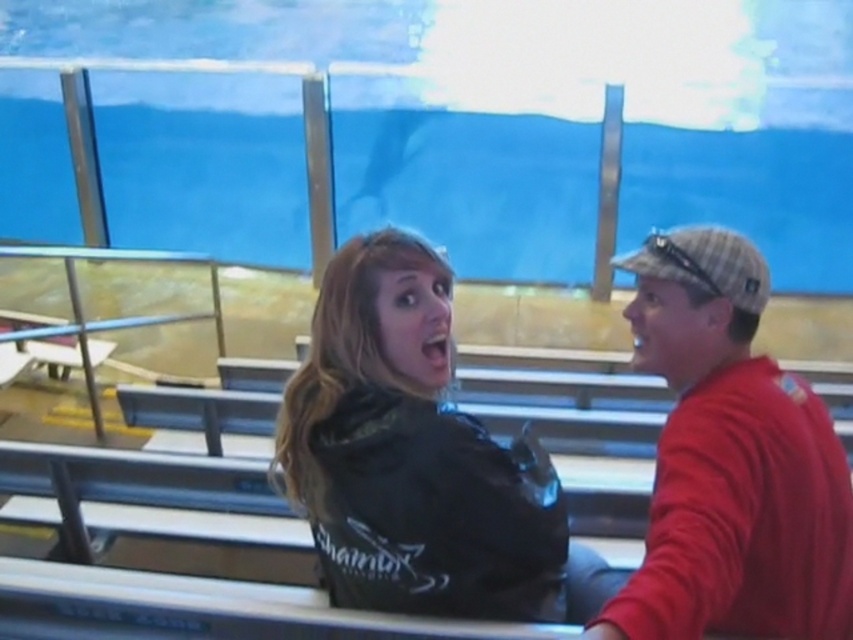
Is red cotton shirt at right thinner than black matte jacket at center?

Indeed, red cotton shirt at right has a lesser width compared to black matte jacket at center.

Is red cotton shirt at right closer to camera compared to black matte jacket at center?

Yes, red cotton shirt at right is in front of black matte jacket at center.

The width and height of the screenshot is (853, 640). What do you see at coordinates (730, 461) in the screenshot? I see `red cotton shirt at right` at bounding box center [730, 461].

Identify the location of red cotton shirt at right. The width and height of the screenshot is (853, 640). (730, 461).